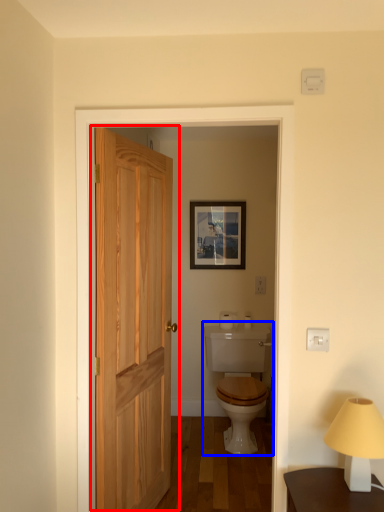
Question: Which point is further to the camera, door (highlighted by a red box) or sink (highlighted by a blue box)?

Choices:
 (A) door
 (B) sink

Answer: (B)